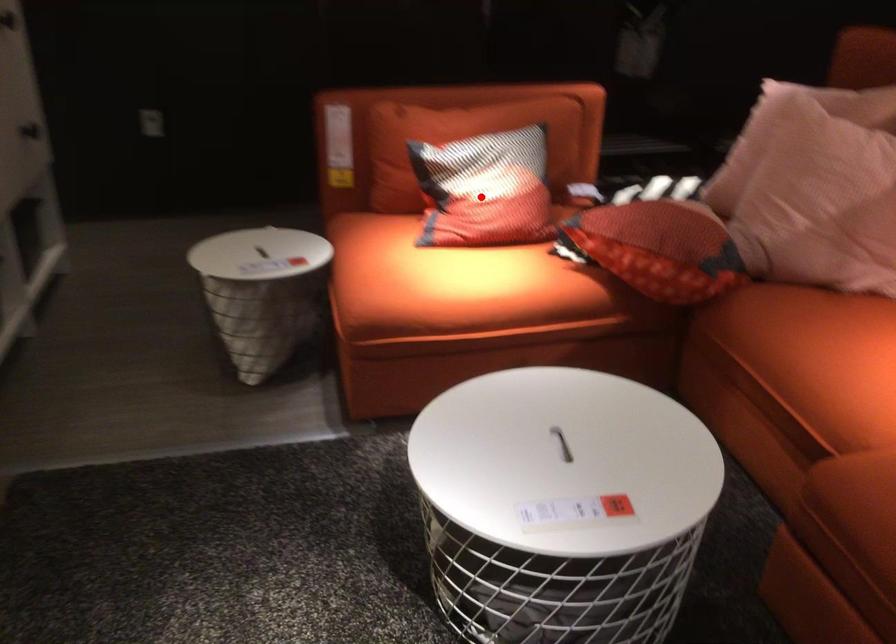
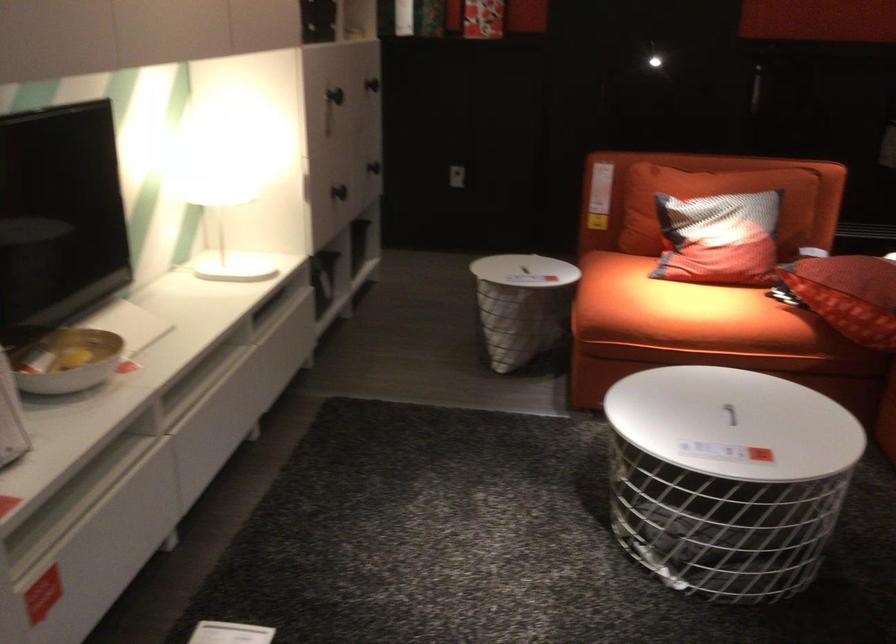
Question: A red point is marked in image1. In image2, is the corresponding 3D point closer to the camera or farther? Reply with the corresponding letter.

Choices:
 (A) The corresponding 3D point is closer.
 (B) The corresponding 3D point is farther.

Answer: (B)